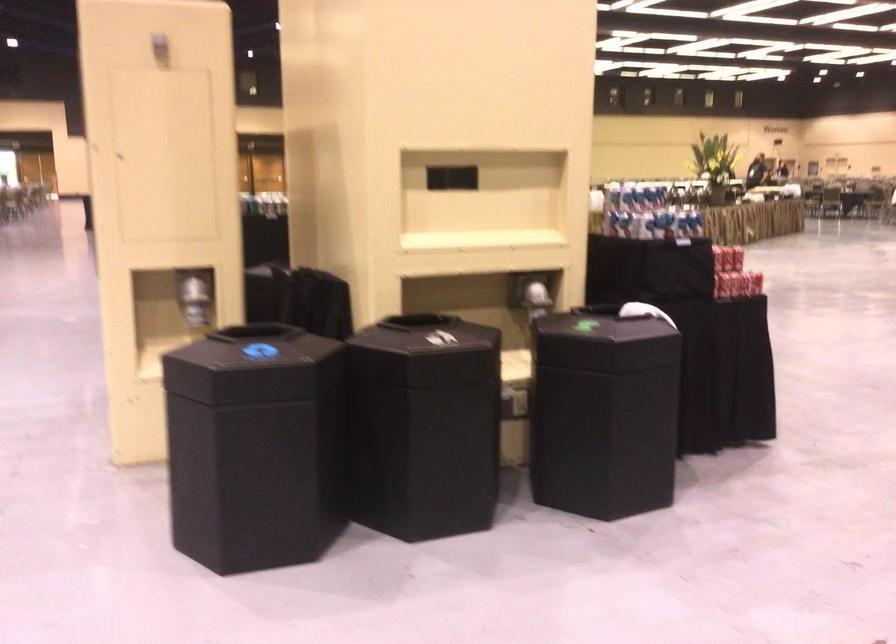
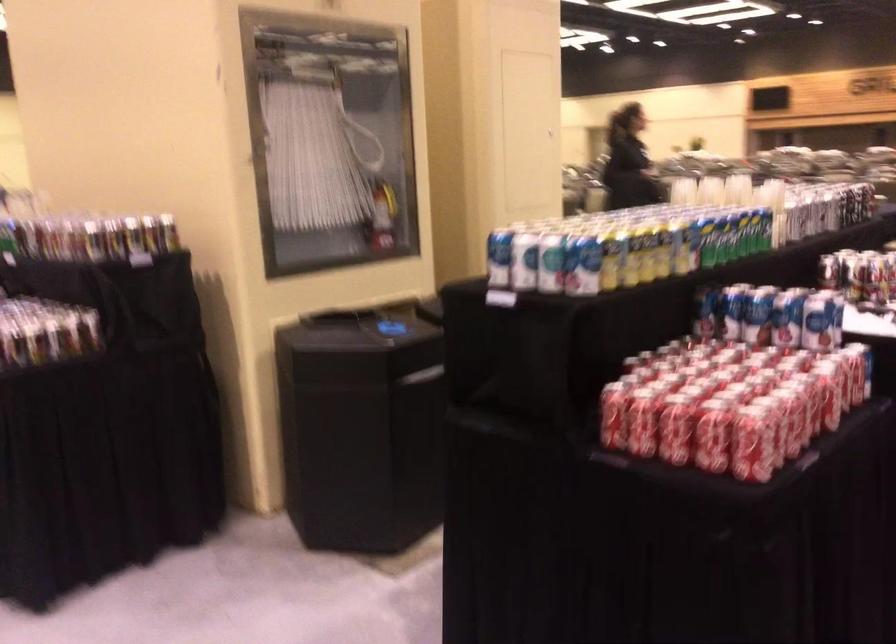
Question: I am providing you with two images of the same scene from different viewpoints. Please identify which objects are invisible in image2.

Choices:
 (A) green and yellow can
 (B) blue bottle cap
 (C) shiny dispenser lever
 (D) red soda can

Answer: (C)